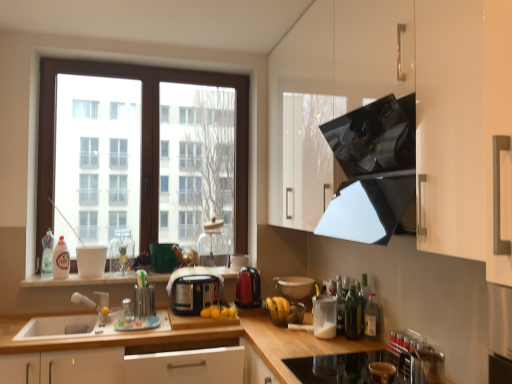
Question: Is point (358, 301) positioned closer to the camera than point (275, 288)?

Choices:
 (A) farther
 (B) closer

Answer: (B)

Question: Is green glass bottle at lower right, which is the second bottle in right-to-left order, wider or thinner than matte brown bowl at center, the sixth appliance from the front?

Choices:
 (A) thin
 (B) wide

Answer: (A)

Question: Estimate the real-world distances between objects in this image. Which object is farther from the metallic green pen holder at center, the 4th appliance from the back?

Choices:
 (A) matte black toaster at center, which appears as the 5th appliance when viewed from the back
 (B) white glossy bottle at left, the second bottle from the back
 (C) black glass cooktop at lower center, arranged as the seventh appliance when viewed from the back
 (D) wooden at lower left
 (E) brown wooden window at left

Answer: (C)

Question: Which is nearer to the translucent plastic bottle at center, which ranks as the third bottle in left-to-right order?

Choices:
 (A) wooden bowl at lower center, placed as the 3th appliance when sorted from front to back
 (B) metallic green pen holder at center, the 4th appliance from the back
 (C) red glossy electric kettle at center, the first kitchen appliance positioned from the left
 (D) matte black toaster at center, marked as the 4th appliance in a front-to-back arrangement
 (E) wooden at left

Answer: (C)